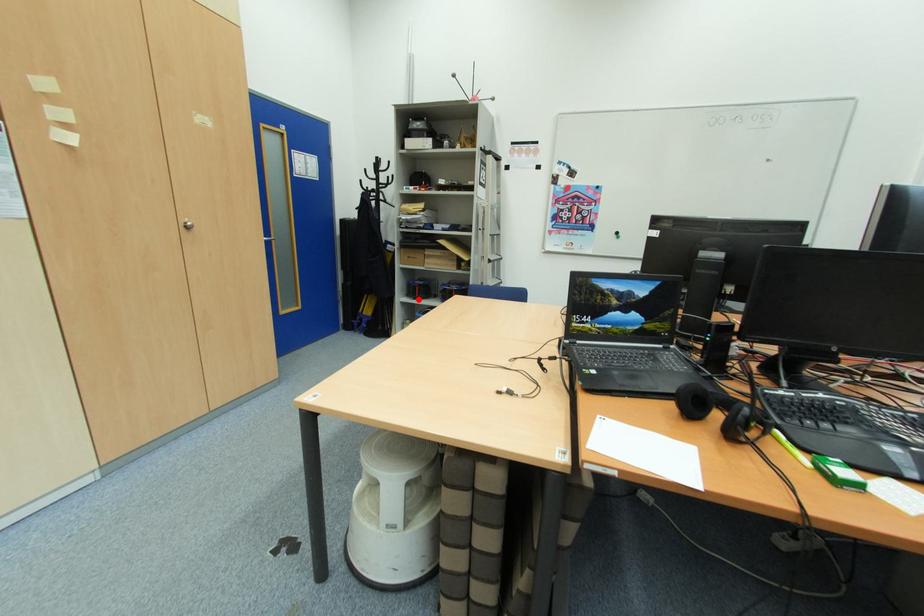
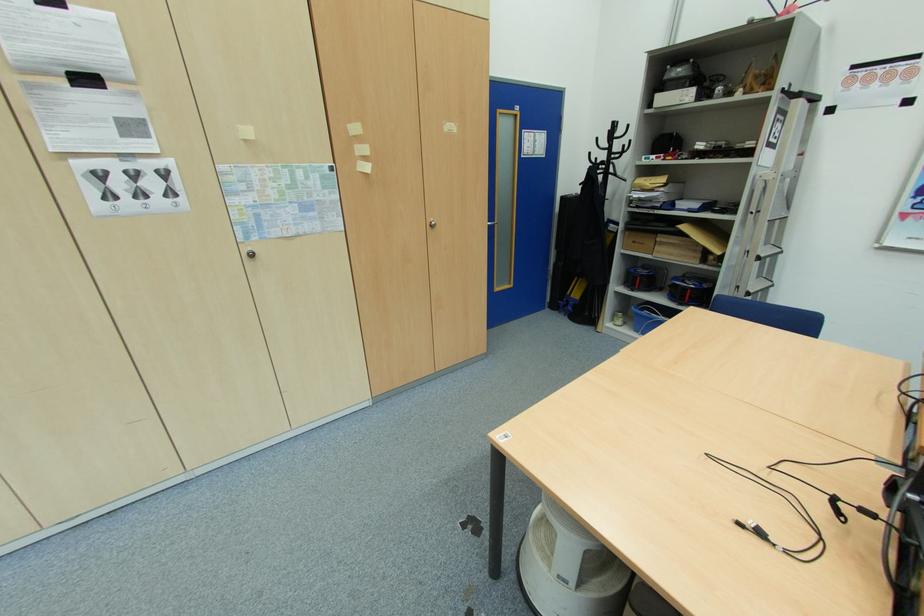
Locate, in the second image, the point that corresponds to the highlighted location in the first image.

(637, 291)